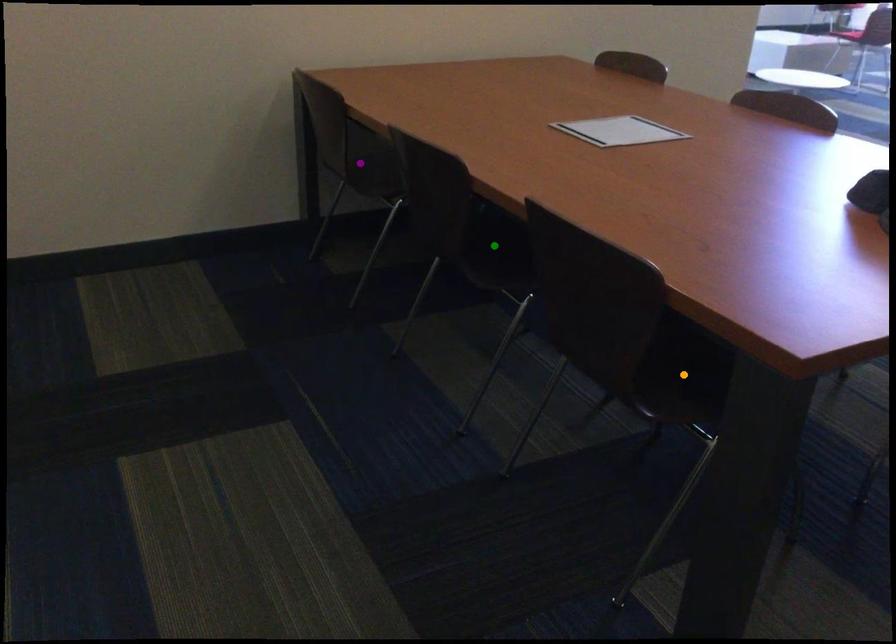
Order these from nearest to farthest:
A) purple point
B) green point
C) orange point

orange point
green point
purple point